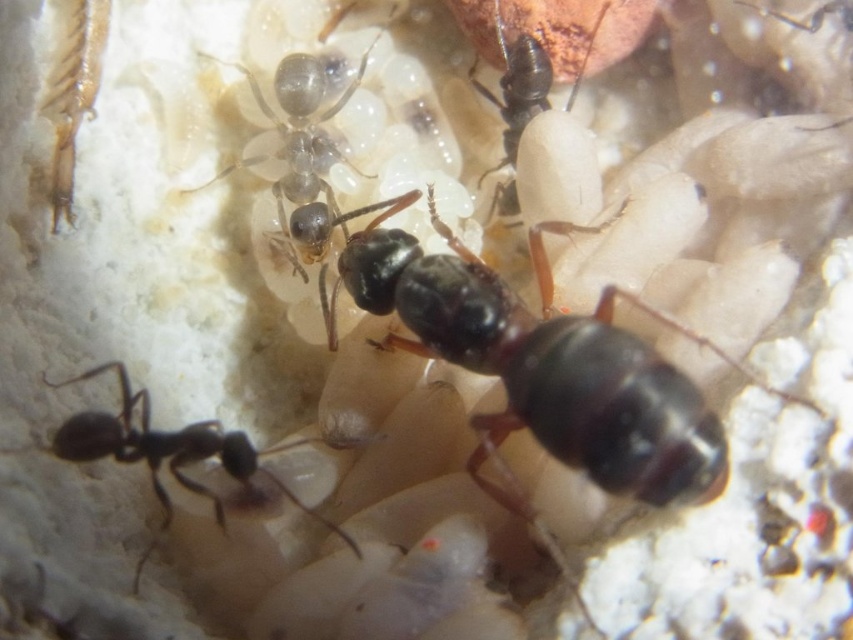
Can you confirm if black glossy ant at lower left is smaller than black glossy ant at upper center?

Actually, black glossy ant at lower left might be larger than black glossy ant at upper center.

Does black glossy ant at lower left have a greater width compared to black glossy ant at upper center?

Correct, the width of black glossy ant at lower left exceeds that of black glossy ant at upper center.

Is point (248, 468) positioned after point (512, 67)?

No.

Where is `black glossy ant at lower left`? Image resolution: width=853 pixels, height=640 pixels. black glossy ant at lower left is located at coordinates (173, 452).

Is black glossy ant at lower left further to camera compared to translucent gelatinous ant at center?

That is False.

Describe the element at coordinates (173, 452) in the screenshot. I see `black glossy ant at lower left` at that location.

You are a GUI agent. You are given a task and a screenshot of the screen. Output one action in this format:
    pyautogui.click(x=<x>, y=<y>)
    Task: Click on the black glossy ant at lower left
    This screenshot has width=853, height=640.
    Given the screenshot: What is the action you would take?
    pyautogui.click(x=173, y=452)

Identify the location of black glossy ant at lower left. (173, 452).

Does shiny black ant at center have a greater height compared to black glossy ant at lower left?

Indeed, shiny black ant at center has a greater height compared to black glossy ant at lower left.

Who is more distant from viewer, (524, 330) or (209, 449)?

Positioned behind is point (524, 330).

I want to click on shiny black ant at center, so click(546, 371).